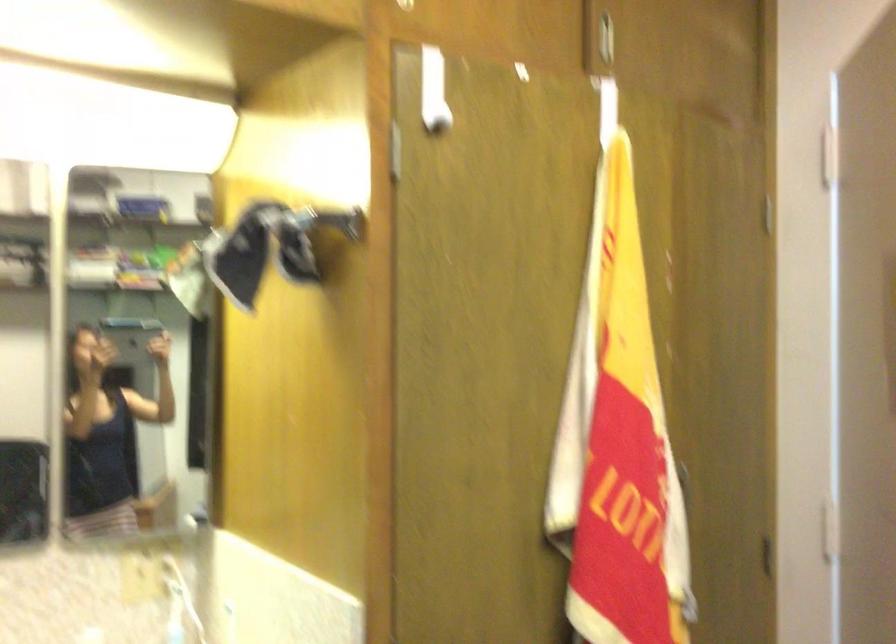
The first image is from the beginning of the video and the second image is from the end. How did the camera likely rotate when shooting the video?

The camera rotated toward right-down.